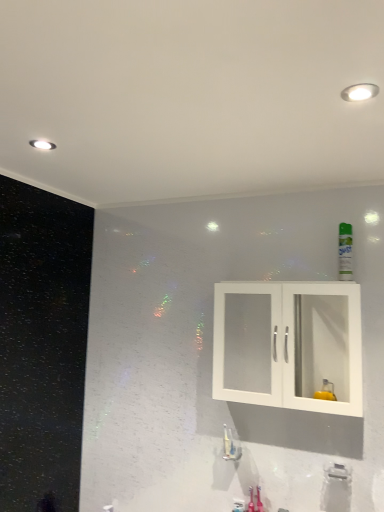
Question: In terms of width, does white plastic faucet at lower center, acting as the 2th plumbing fixture starting from the top, look wider or thinner when compared to white glossy faucet at lower center, which ranks as the 1th plumbing fixture in back-to-front order?

Choices:
 (A) thin
 (B) wide

Answer: (B)

Question: From a real-world perspective, relative to white glossy faucet at lower center, marked as the 2th plumbing fixture in a right-to-left arrangement, is white plastic faucet at lower center, acting as the 2th plumbing fixture starting from the top, vertically above or below?

Choices:
 (A) below
 (B) above

Answer: (A)

Question: Based on their relative distances, which object is nearer to the white glossy faucet at lower center, placed as the second plumbing fixture when sorted from front to back?

Choices:
 (A) green matte mouthwash at upper right
 (B) white matte cabinet at center
 (C) white plastic faucet at lower center, which is counted as the second plumbing fixture, starting from the left

Answer: (C)

Question: Which of these objects is positioned farthest from the white glossy faucet at lower center, the second plumbing fixture ordered from the bottom?

Choices:
 (A) white plastic faucet at lower center, acting as the 2th plumbing fixture starting from the top
 (B) green matte mouthwash at upper right
 (C) white matte cabinet at center

Answer: (B)